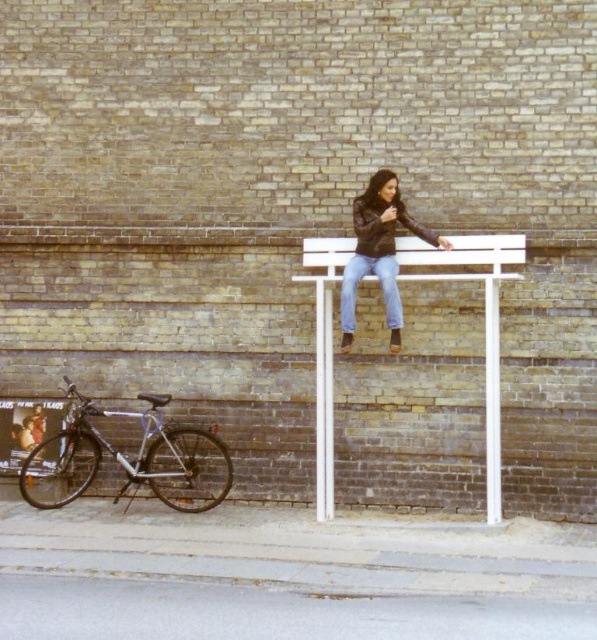
Question: Which object appears farthest from the camera in this image?

Choices:
 (A) leather jacket at center
 (B) blue denim jeans at center
 (C) silver metallic bicycle at lower left

Answer: (C)

Question: Is leather jacket at center bigger than blue denim jeans at center?

Choices:
 (A) no
 (B) yes

Answer: (B)

Question: Which of the following is the farthest from the observer?

Choices:
 (A) (383, 189)
 (B) (158, 404)
 (C) (350, 280)

Answer: (B)

Question: Can you confirm if silver metallic bicycle at lower left is bigger than blue denim jeans at center?

Choices:
 (A) yes
 (B) no

Answer: (A)

Question: Does leather jacket at center appear on the right side of blue denim jeans at center?

Choices:
 (A) yes
 (B) no

Answer: (A)

Question: Among these points, which one is nearest to the camera?

Choices:
 (A) (75, 486)
 (B) (365, 214)

Answer: (B)